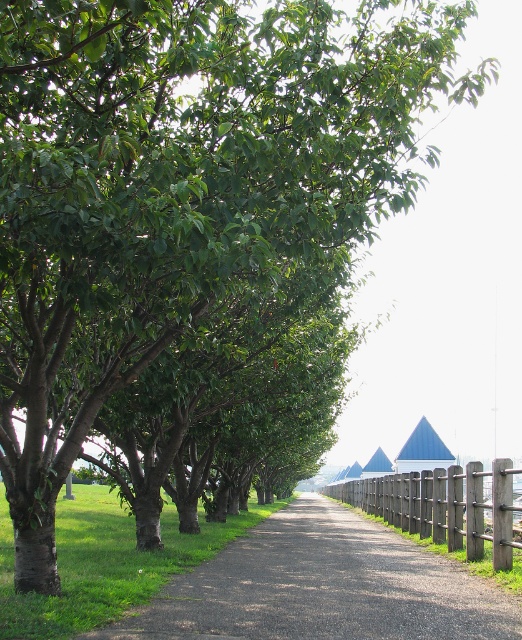
Does gravel path at center have a larger size compared to brown wooden fence at center?

Incorrect, gravel path at center is not larger than brown wooden fence at center.

Is point (247, 566) less distant than point (416, 472)?

Yes, point (247, 566) is in front of point (416, 472).

I want to click on gravel path at center, so [x=323, y=588].